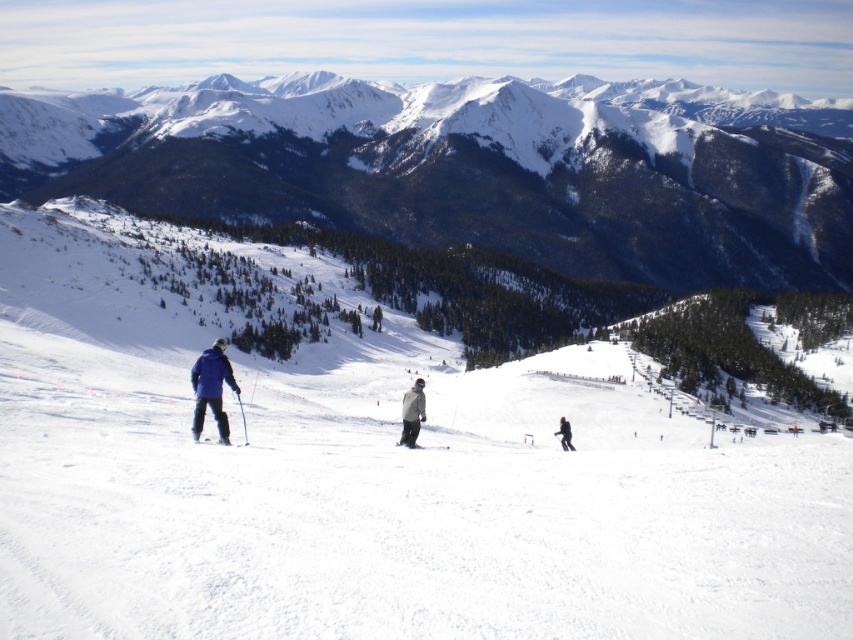
Question: Which point appears farthest from the camera in this image?

Choices:
 (A) (202, 406)
 (B) (407, 444)
 (C) (219, 436)
 (D) (421, 417)

Answer: (D)

Question: Estimate the real-world distances between objects in this image. Which object is farther from the black matte ski at center?

Choices:
 (A) snowy rocky mountains at upper center
 (B) gray matte jacket at center
 (C) matte blue jacket at left

Answer: (A)

Question: Is matte blue jacket at left positioned in front of gray matte jacket at center?

Choices:
 (A) no
 (B) yes

Answer: (B)

Question: Which of the following is the farthest from the observer?

Choices:
 (A) snowy rocky mountains at upper center
 (B) black matte ski at center
 (C) black matte jacket at center

Answer: (A)

Question: Does snowy rocky mountains at upper center have a greater width compared to black matte jacket at center?

Choices:
 (A) yes
 (B) no

Answer: (A)

Question: Does black matte jacket at center appear on the left side of matte blue ski at lower left?

Choices:
 (A) no
 (B) yes

Answer: (A)